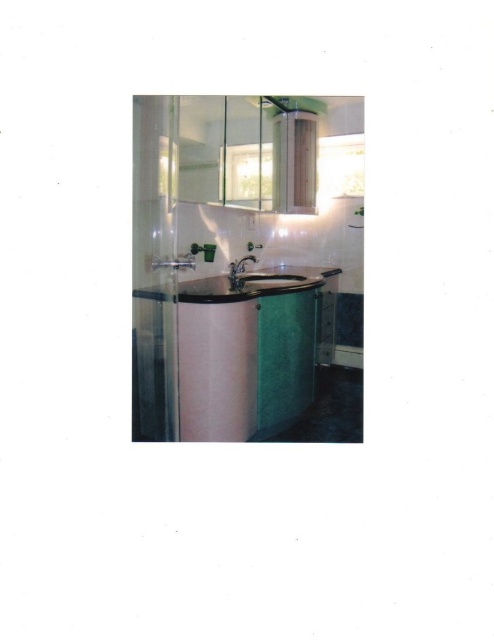
You are standing in the bathroom and want to determine which of the two points, point (279, 288) or point (287, 275), is closer to you. Based on the bathroom layout described, which point is nearer?

Point (279, 288) is closer to the camera than point (287, 275), so it is nearer to you.

You are a plumber inspecting the bathroom. You need to determine if the black glossy sink at center is installed higher than the green marble counter top at center. Based on the scene description, what can you conclude?

The green marble counter top at center has a greater height compared to the black glossy sink at center, so the black glossy sink at center is installed lower than the green marble counter top at center.